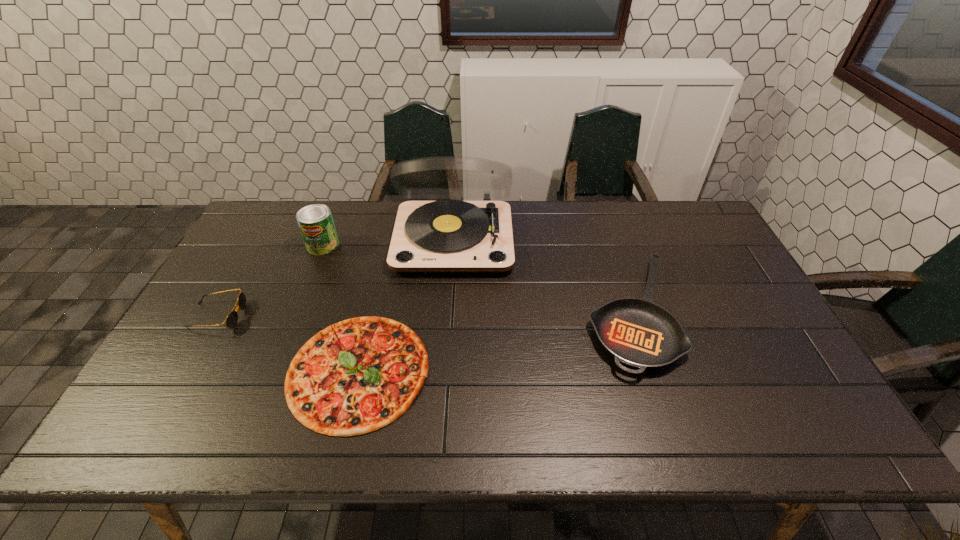
Where is `record player`? record player is located at coordinates (449, 236).

This screenshot has width=960, height=540. I want to click on can, so click(x=316, y=224).

The height and width of the screenshot is (540, 960). I want to click on the third tallest object, so click(232, 318).

Locate an element on the screen. The width and height of the screenshot is (960, 540). the leftmost object is located at coordinates (232, 318).

Find the location of a particular element. frying pan is located at coordinates (636, 332).

This screenshot has height=540, width=960. I want to click on the second shortest object, so click(x=636, y=332).

At what (x,y) coordinates should I click in order to perform the action: click on the shortest object. Please return your answer as a coordinate pair (x, y). Looking at the image, I should click on (356, 376).

Image resolution: width=960 pixels, height=540 pixels. I want to click on free space located 0.110m with the tonearm facing the front of the record player, so click(x=449, y=305).

At what (x,y) coordinates should I click in order to perform the action: click on vacant space located on the left of the can. Please return your answer as a coordinate pair (x, y). Looking at the image, I should click on (277, 245).

Where is `vacant space located on the front-facing side of the third shortest object`? vacant space located on the front-facing side of the third shortest object is located at coordinates (328, 316).